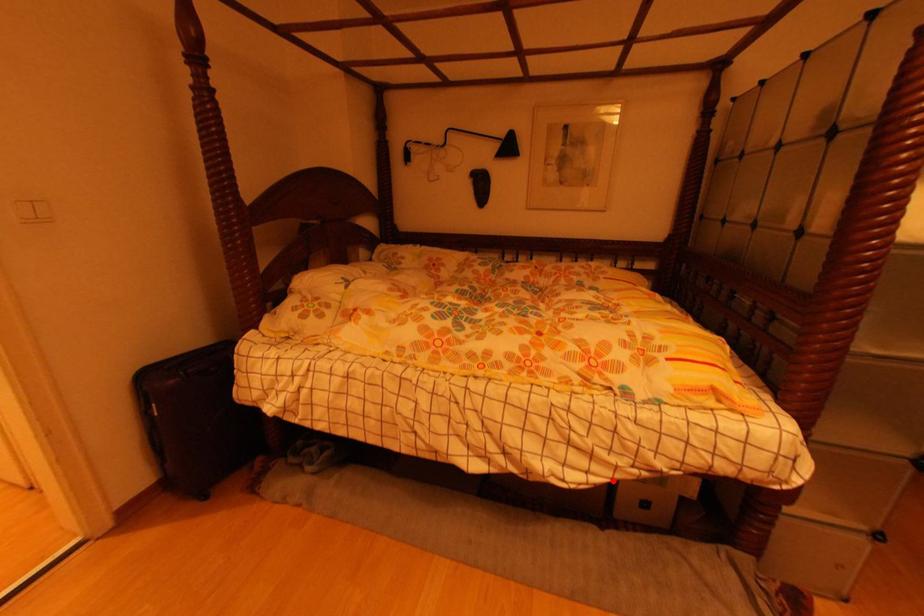
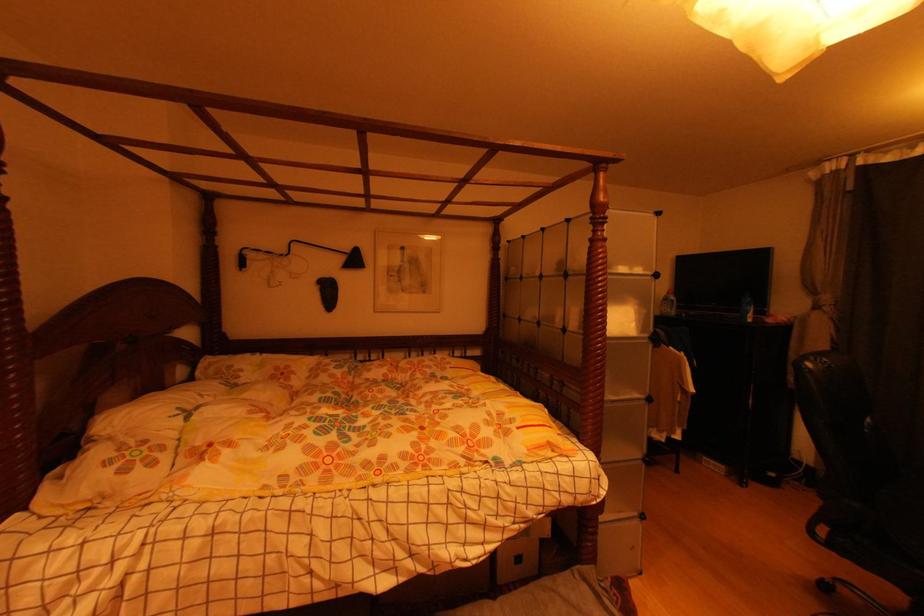
The point at the highlighted location is marked in the first image. Where is the corresponding point in the second image?

(504, 545)